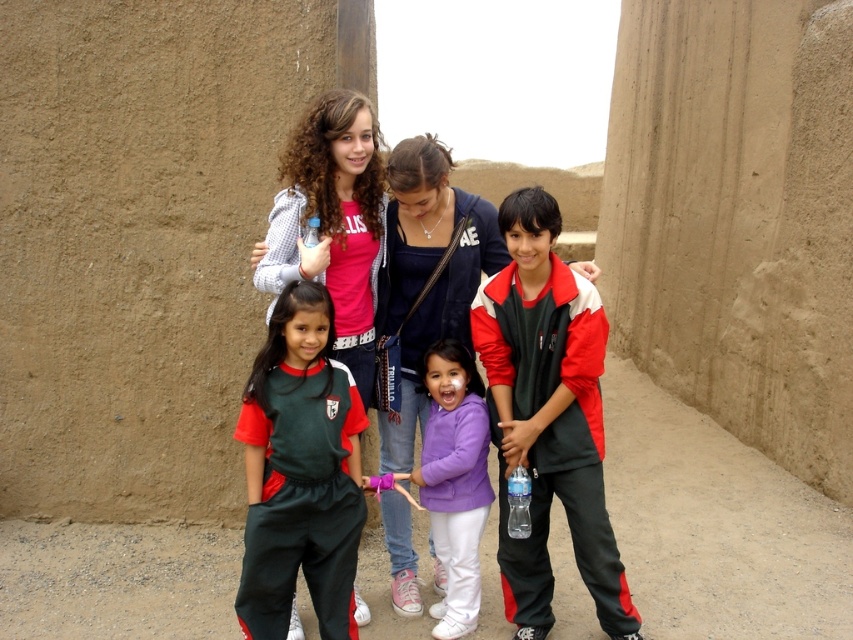
You are a photographer trying to capture a group shot of the children. You notice two jackets in the center of the image, a red and white jacket at center and a purple fleece jacket at center. Which jacket should you focus on if you want to highlight the one that takes up more space in the photo?

The red and white jacket at center might be wider than purple fleece jacket at center, so focusing on the red and white jacket at center would better highlight the one that takes up more space in the photo.

You are a photographer trying to capture a group shot of the children in the desert setting. The two children wearing the red and white jacket at center and the dark green jersey at center are currently 1.24 meters apart. To ensure both are in frame without moving them, what is the minimum width of the camera lens you should use?

The minimum width of the camera lens should be at least 1.24 meters to ensure both the red and white jacket at center and the dark green jersey at center are captured in frame without moving them.

You are trying to locate two jackets in the image. The red and white jacket at center and the purple fleece jacket at center are both visible. Which one is positioned more to the east?

The red and white jacket at center is to the right of the purple fleece jacket at center, so if the image is oriented with right as east, the red and white jacket at center is more to the east.